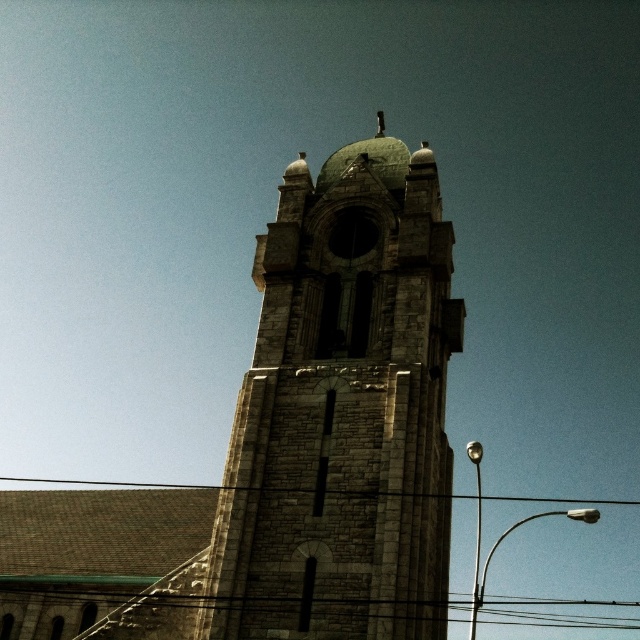
Question: In this image, where is stone tower at center located relative to black wire at lower center?

Choices:
 (A) below
 (B) above

Answer: (B)

Question: Can you confirm if stone tower at center is thinner than black wire at lower center?

Choices:
 (A) yes
 (B) no

Answer: (A)

Question: Can you confirm if stone tower at center is thinner than black wire at lower center?

Choices:
 (A) yes
 (B) no

Answer: (A)